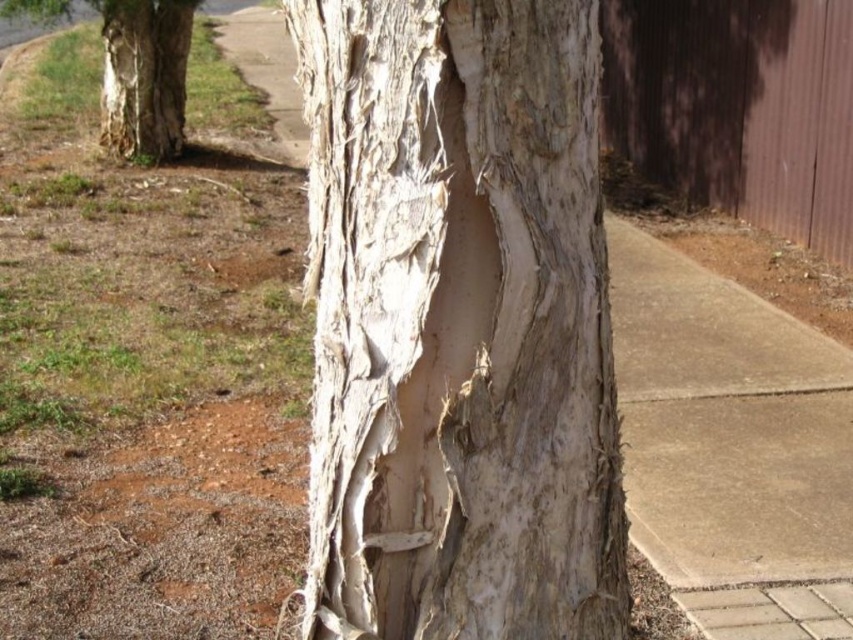
Between white textured bark at center and white textured bark at left, which one appears on the left side from the viewer's perspective?

white textured bark at left

Is white textured bark at center bigger than white textured bark at left?

No.

Which is behind, point (401, 230) or point (177, 128)?

Positioned behind is point (177, 128).

You are a GUI agent. You are given a task and a screenshot of the screen. Output one action in this format:
    pyautogui.click(x=<x>, y=<y>)
    Task: Click on the white textured bark at center
    The image size is (853, 640).
    Given the screenshot: What is the action you would take?
    pyautogui.click(x=457, y=323)